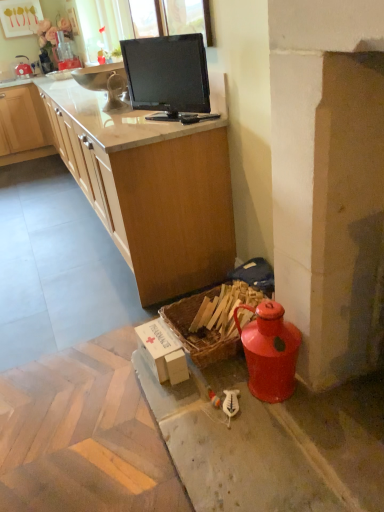
Question: Is point (215, 291) positioned closer to the camera than point (160, 358)?

Choices:
 (A) closer
 (B) farther

Answer: (B)

Question: Considering the positions of woven wood picnic basket at lower right and white cardboard box at lower center in the image, is woven wood picnic basket at lower right taller or shorter than white cardboard box at lower center?

Choices:
 (A) short
 (B) tall

Answer: (B)

Question: Estimate the real-world distances between objects in this image. Which object is farther from the matte wood countertop at upper center?

Choices:
 (A) white cardboard box at lower center
 (B) black glossy monitor at upper center
 (C) woven wood picnic basket at lower right

Answer: (A)

Question: Which object is the closest to the black glossy monitor at upper center?

Choices:
 (A) white cardboard box at lower center
 (B) matte wood countertop at upper center
 (C) woven wood picnic basket at lower right

Answer: (B)